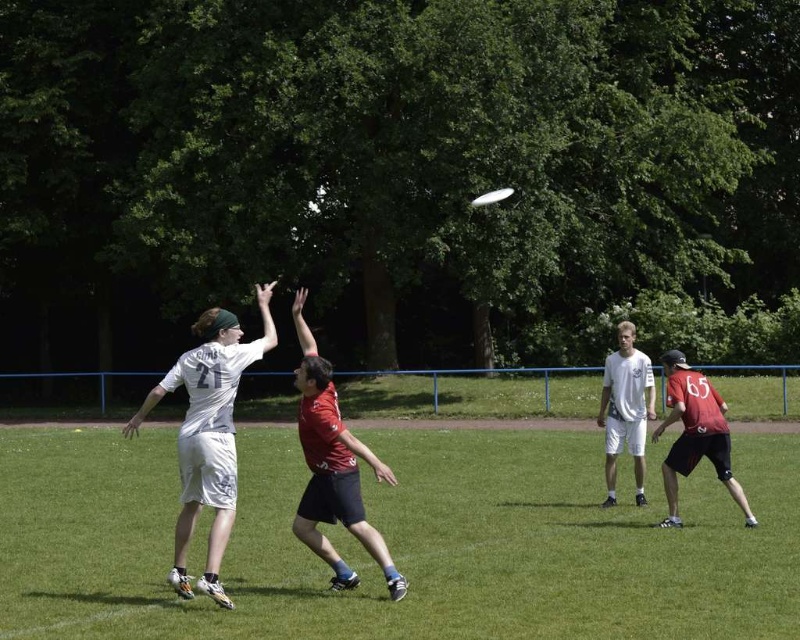
Where is `green grass at center`? The image size is (800, 640). green grass at center is located at coordinates (400, 544).

Can you confirm if green grass at center is smaller than white matte jersey at center?

Yes.

Which is in front, point (704, 476) or point (200, 358)?

Point (200, 358) is in front.

Image resolution: width=800 pixels, height=640 pixels. I want to click on green grass at center, so click(400, 544).

Which is below, white matte jersey at center or red matte jersey at center?

red matte jersey at center

Which is more to the left, white matte jersey at center or red matte jersey at center?

white matte jersey at center is more to the left.

Is point (230, 312) farther from viewer compared to point (678, 401)?

Yes, point (230, 312) is farther from viewer.

Find the location of a particular element. The width and height of the screenshot is (800, 640). white matte jersey at center is located at coordinates (208, 433).

Who is positioned more to the left, red matte jersey at center or white matte shorts at center?

red matte jersey at center

What do you see at coordinates (696, 435) in the screenshot?
I see `red matte jersey at center` at bounding box center [696, 435].

What do you see at coordinates (696, 435) in the screenshot?
I see `red matte jersey at center` at bounding box center [696, 435].

I want to click on red matte jersey at center, so click(696, 435).